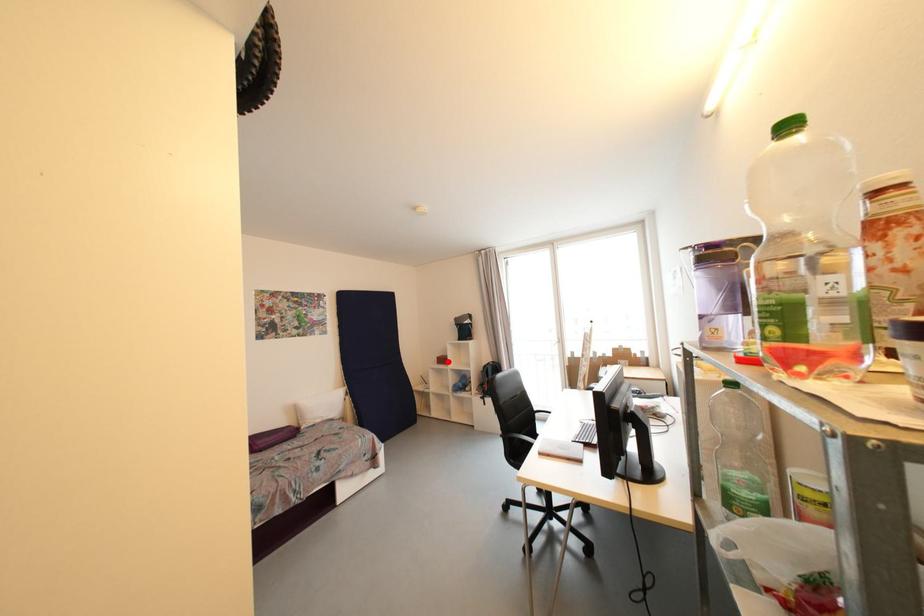
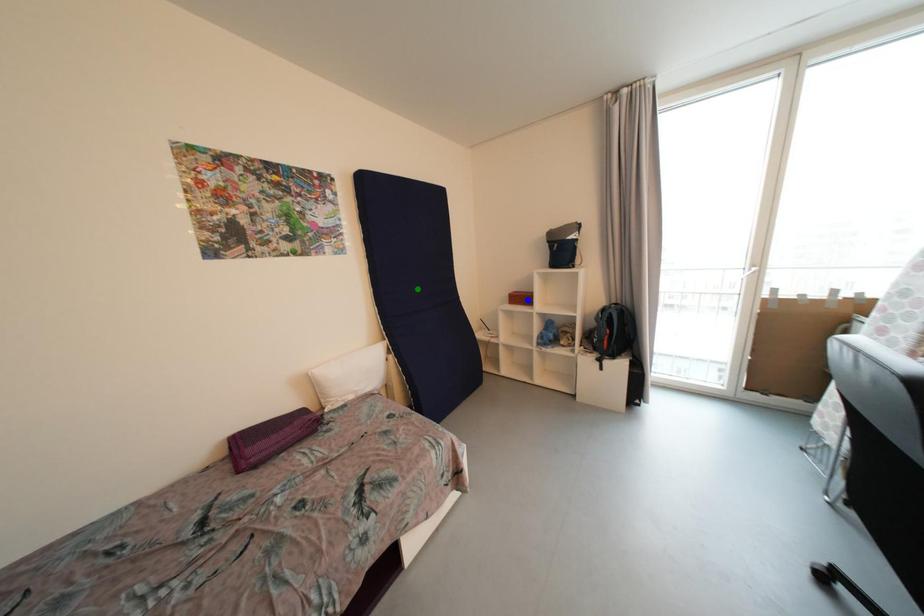
Question: I am providing you with two images of the same scene from different viewpoints. A red point is marked on the first image. You are given multiple points on the second image. Which point in image 2 is actually the same real-world point as the red point in image 1?

Choices:
 (A) blue point
 (B) yellow point
 (C) green point

Answer: (A)